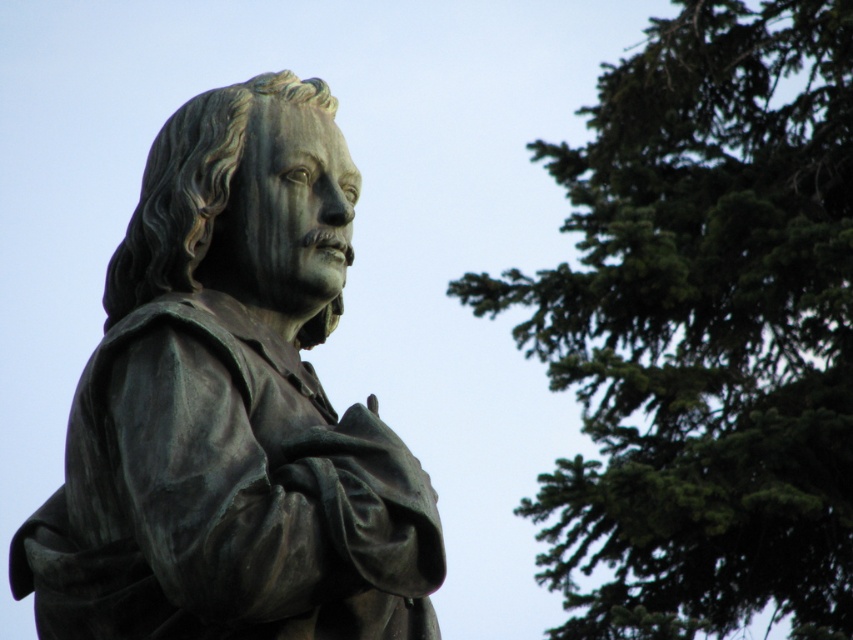
Question: Which of the following is the farthest from the observer?

Choices:
 (A) (158, 577)
 (B) (706, 244)

Answer: (B)

Question: Which of the following is the farthest from the observer?

Choices:
 (A) (160, 248)
 (B) (813, 42)

Answer: (B)

Question: Can you confirm if green needle-like leaves at upper right is bigger than bronze statue at left?

Choices:
 (A) yes
 (B) no

Answer: (A)

Question: Is green needle-like leaves at upper right further to the viewer compared to bronze statue at left?

Choices:
 (A) yes
 (B) no

Answer: (A)

Question: Which point is closer to the camera?

Choices:
 (A) bronze statue at left
 (B) green needle-like leaves at upper right

Answer: (A)

Question: Does green needle-like leaves at upper right appear under bronze statue at left?

Choices:
 (A) no
 (B) yes

Answer: (A)